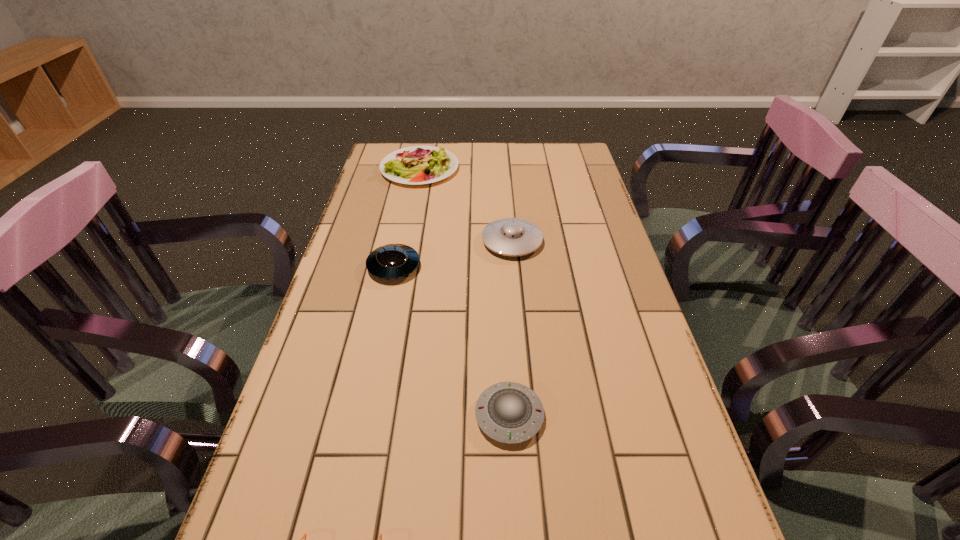
Locate an element on the screen. The width and height of the screenshot is (960, 540). saucer that is positioned at the left edge is located at coordinates (393, 261).

Where is `object located at the far left corner`? object located at the far left corner is located at coordinates 414,165.

Image resolution: width=960 pixels, height=540 pixels. Find the location of `vacant space at the far edge of the desktop`. vacant space at the far edge of the desktop is located at coordinates (535, 162).

The width and height of the screenshot is (960, 540). In the image, there is a desktop. What are the coordinates of `free region at the left edge` in the screenshot? It's located at (372, 188).

You are a GUI agent. You are given a task and a screenshot of the screen. Output one action in this format:
    pyautogui.click(x=<x>, y=<y>)
    Task: Click on the vacant area at the right edge
    The width and height of the screenshot is (960, 540).
    Given the screenshot: What is the action you would take?
    pyautogui.click(x=579, y=315)

The width and height of the screenshot is (960, 540). In the image, there is a desktop. In order to click on vacant region at the far right corner in this screenshot , I will do `click(575, 147)`.

At what (x,y) coordinates should I click in order to perform the action: click on object that stands as the third closest to the nearest object. Please return your answer as a coordinate pair (x, y). The image size is (960, 540). Looking at the image, I should click on (508, 236).

Find the location of `object that stands as the third closest to the second nearest object`. object that stands as the third closest to the second nearest object is located at coordinates (508, 236).

Where is `the closest saucer to the salad plate`? The width and height of the screenshot is (960, 540). the closest saucer to the salad plate is located at coordinates pyautogui.click(x=508, y=236).

Locate an element on the screen. This screenshot has height=540, width=960. saucer that stands as the second closest to the leftmost saucer is located at coordinates (508, 412).